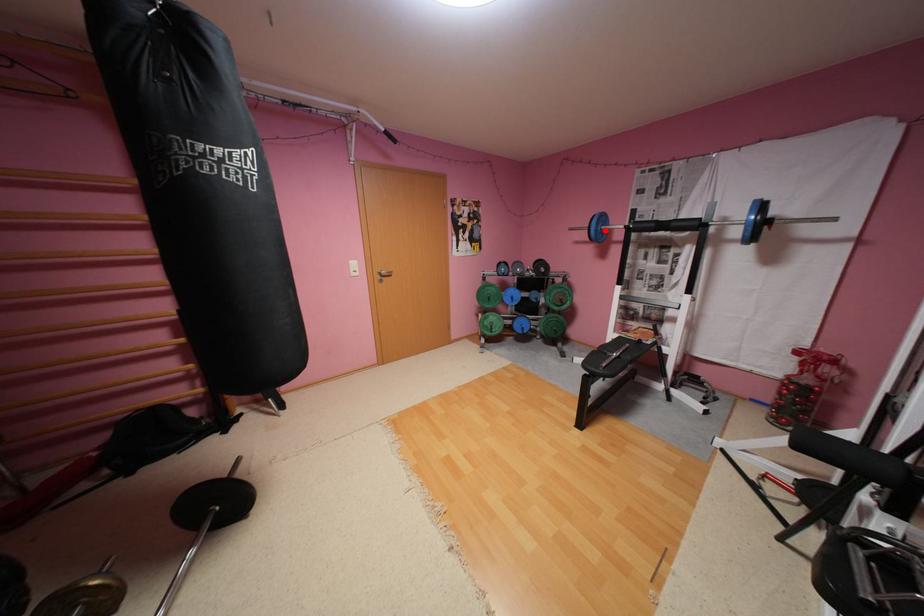
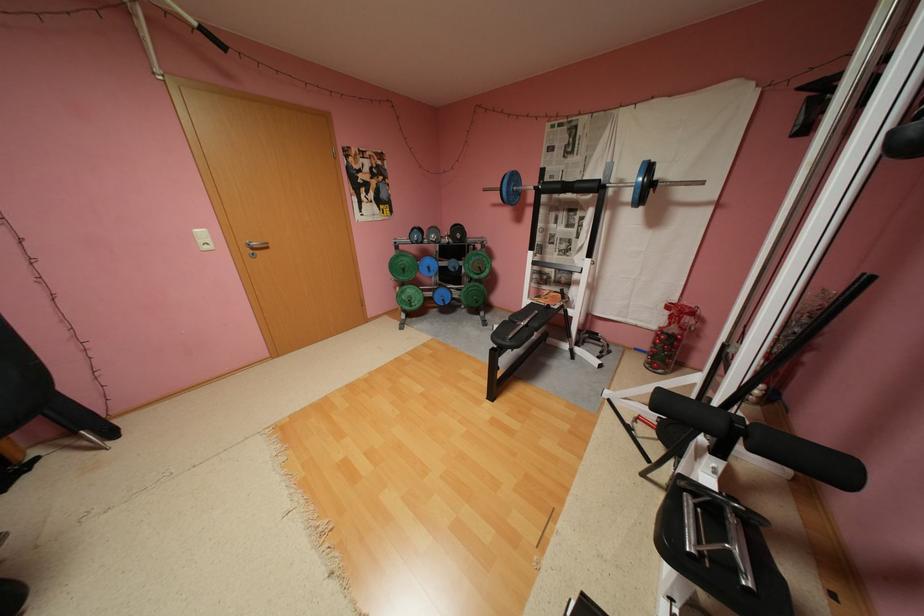
The point at the highlighted location is marked in the first image. Where is the corresponding point in the second image?

(517, 191)